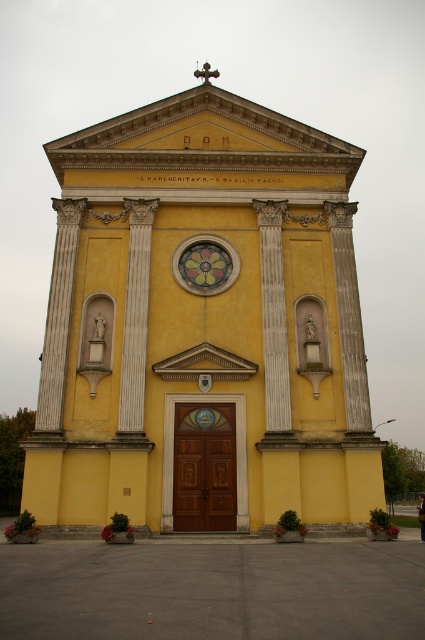
Consider the image. You are an architect planning to install a new lighting system for the yellow matte church at center. The stained glass window at center requires special lighting to highlight its floral pattern. Given the height difference between the two, which object will require a taller ladder for installation?

The yellow matte church at center is much taller than the stained glass window at center, so the lighting installation for the yellow matte church at center will require a taller ladder.